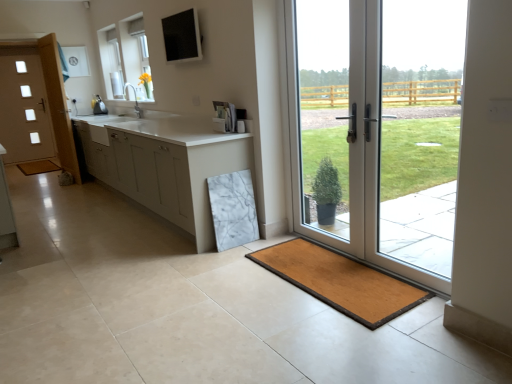
Question: Is brown wooden bath mat at lower left, which appears as the 2th bath mat when viewed from the right, taller or shorter than white glossy door at right, positioned as the first door in front-to-back order?

Choices:
 (A) tall
 (B) short

Answer: (B)

Question: Is point (31, 160) closer or farther from the camera than point (440, 62)?

Choices:
 (A) closer
 (B) farther

Answer: (B)

Question: Which is nearer to the white glass door at left, the 1th door in the left-to-right sequence?

Choices:
 (A) white glossy door at right, the 2th door from the left
 (B) brown rubber bath mat at lower right, the 1th bath mat when ordered from front to back
 (C) brown wooden bath mat at lower left, marked as the 1th bath mat in a top-to-bottom arrangement
 (D) matte black screen at upper center
 (E) white matte cabinet at center

Answer: (C)

Question: Considering the real-world distances, which object is closest to the white glossy door at right, the 2th door from the left?

Choices:
 (A) brown rubber bath mat at lower right, the 2th bath mat positioned from the top
 (B) white matte cabinet at center
 (C) matte black screen at upper center
 (D) white glass door at left, the 1th door in the left-to-right sequence
 (E) brown wooden bath mat at lower left, placed as the second bath mat when sorted from front to back

Answer: (A)